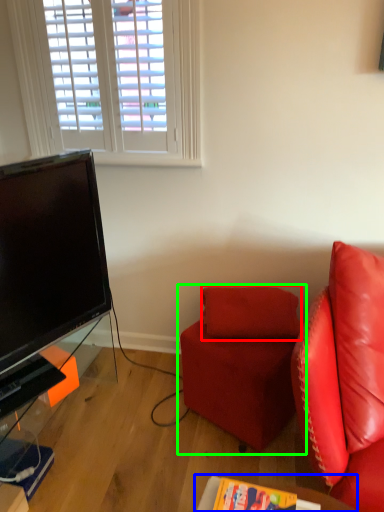
Question: Considering the real-world distances, which object is closest to pillow (highlighted by a red box)? table (highlighted by a blue box) or studio couch (highlighted by a green box).

Choices:
 (A) table
 (B) studio couch

Answer: (B)